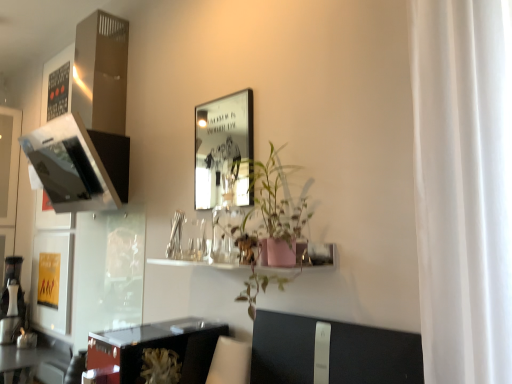
Question: Based on their sizes in the image, would you say shiny black table at lower left, acting as the 2th table starting from the right, is bigger or smaller than pink matte shelf at center?

Choices:
 (A) small
 (B) big

Answer: (A)

Question: From a real-world perspective, relative to pink matte shelf at center, is shiny black table at lower left, which is the 2th table in front-to-back order, vertically above or below?

Choices:
 (A) below
 (B) above

Answer: (A)

Question: Which is nearer to the metallic silver picture frame at upper center?

Choices:
 (A) pink matte shelf at center
 (B) transparent glass door at lower left
 (C) shiny black table at lower left, acting as the 2th table starting from the right
 (D) white plastic swivel chair at lower center
 (E) pink matte plant at center

Answer: (B)

Question: Estimate the real-world distances between objects in this image. Which object is closer to the metallic silver picture frame at upper center?

Choices:
 (A) transparent glass door at lower left
 (B) white plastic swivel chair at lower center
 (C) shiny black table at lower left, acting as the 2th table starting from the right
 (D) pink matte plant at center
 (E) shiny black table at lower left, placed as the second table when sorted from left to right

Answer: (A)